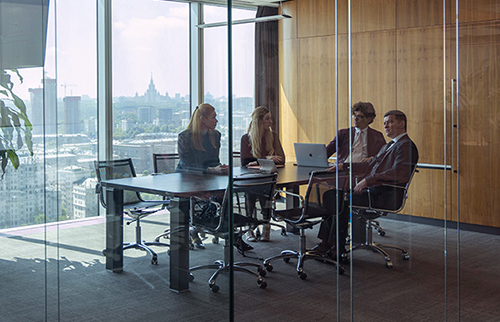
You are a GUI agent. You are given a task and a screenshot of the screen. Output one action in this format:
    pyautogui.click(x=<x>, y=<y>)
    Task: Click on the chairs
    This screenshot has width=500, height=322.
    Given the screenshot: What is the action you would take?
    pyautogui.click(x=124, y=168), pyautogui.click(x=167, y=165), pyautogui.click(x=238, y=156), pyautogui.click(x=390, y=205), pyautogui.click(x=312, y=212), pyautogui.click(x=232, y=211)